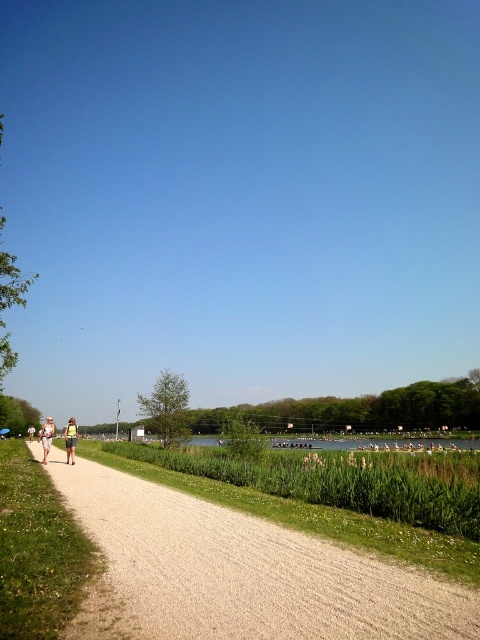
Question: Is light beige fabric couple at center wider than light beige shorts at center?

Choices:
 (A) yes
 (B) no

Answer: (B)

Question: Which of these objects is positioned farthest from the gravel path at left?

Choices:
 (A) light beige fabric jacket at left
 (B) light beige shorts at center
 (C) light beige fabric couple at center

Answer: (A)

Question: Which point is farther to the camera?

Choices:
 (A) light beige fabric couple at center
 (B) gravel path at left

Answer: (A)

Question: Is gravel path at left to the left of light beige fabric jacket at left from the viewer's perspective?

Choices:
 (A) yes
 (B) no

Answer: (B)

Question: Is gravel path at left above light beige fabric jacket at left?

Choices:
 (A) yes
 (B) no

Answer: (A)

Question: Which point appears farthest from the camera in this image?

Choices:
 (A) (437, 616)
 (B) (49, 429)
 (C) (44, 454)

Answer: (C)